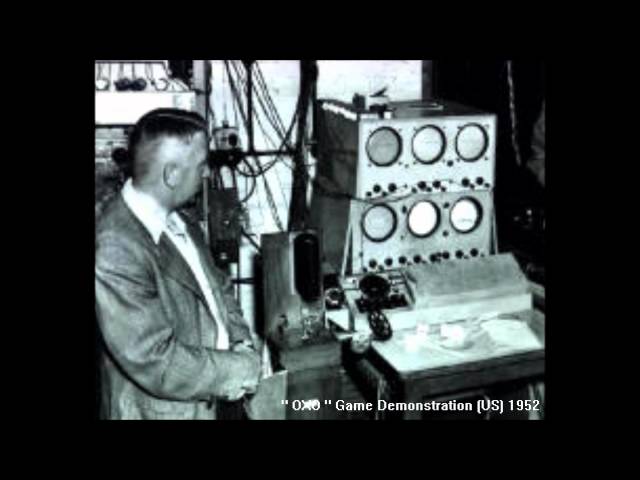
Where is `desk`? This screenshot has width=640, height=480. desk is located at coordinates (475, 374).